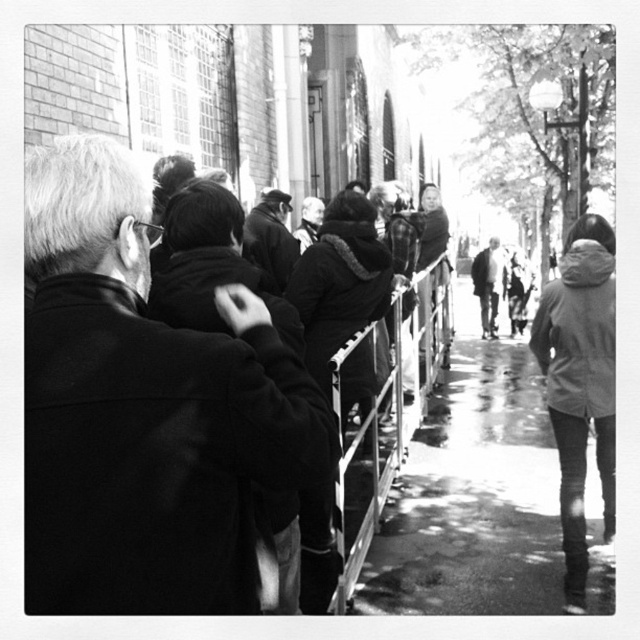
You are a delivery person trying to navigate through the city street scene shown. You need to place a heavy box on the wet asphalt sidewalk at center. Where exactly should you place it?

The wet asphalt sidewalk at center should be placed at point (474, 493).

You are a delivery person trying to navigate through the crowd on the wet asphalt sidewalk at center and the denim jacket at lower right. Since the sidewalk is wet, you need to know which area is safer to walk on. Which object is larger and thus provides more stable footing?

The wet asphalt sidewalk at center is larger in size than the denim jacket at lower right, so it provides more stable footing for walking.

You are a photographer standing on the sidewalk in the image. You want to take a photo of the dark gray coat at center without including the denim jacket at lower right in the frame. Which direction should you move to achieve this?

The denim jacket at lower right is to the left of the dark gray coat at center. To exclude the denim jacket at lower right from the frame while focusing on the dark gray coat at center, you should move to the right side of the dark gray coat at center.